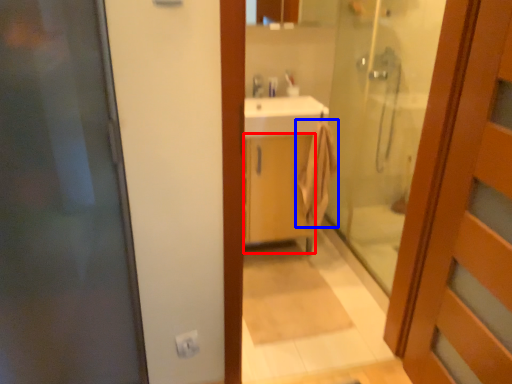
Question: Among these objects, which one is nearest to the camera, cabinetry (highlighted by a red box) or bath towel (highlighted by a blue box)?

Choices:
 (A) cabinetry
 (B) bath towel

Answer: (A)